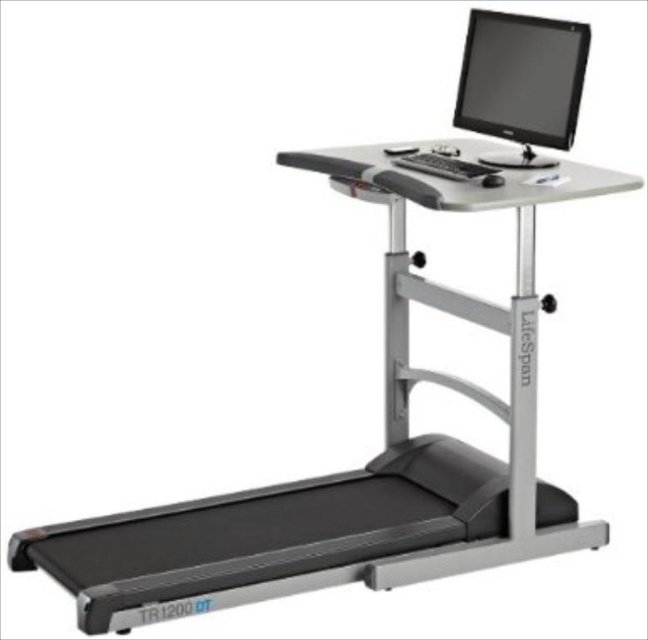
Find the location of a particular element. This screenshot has width=648, height=640. black matte keyboard at upper center is located at coordinates (445, 166).

Does black matte keyboard at upper center have a greater height compared to black plastic mouse at upper center?

Correct, black matte keyboard at upper center is much taller as black plastic mouse at upper center.

Identify the location of black matte keyboard at upper center. (445, 166).

Locate an element on the screen. Image resolution: width=648 pixels, height=640 pixels. black matte keyboard at upper center is located at coordinates (445, 166).

Does black glossy monitor at upper center appear under black plastic mouse at upper center?

No.

Does black glossy monitor at upper center have a greater width compared to black plastic mouse at upper center?

Yes.

Does point (568, 51) come farther from viewer compared to point (491, 173)?

No.

In order to click on black glossy monitor at upper center in this screenshot , I will do (522, 81).

Can you confirm if black glossy monitor at upper center is wider than black matte keyboard at upper center?

Yes.

Is point (544, 33) farther from camera compared to point (421, 152)?

No, it is not.

The height and width of the screenshot is (640, 648). What are the coordinates of `black glossy monitor at upper center` in the screenshot? It's located at (522, 81).